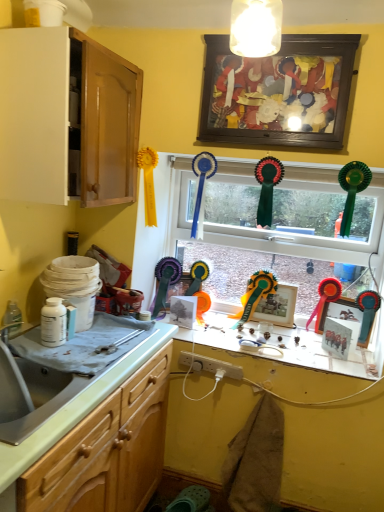
Locate an element on the screen. empty space that is ontop of smooth white countertop at center (from a real-world perspective) is located at coordinates coord(259,341).